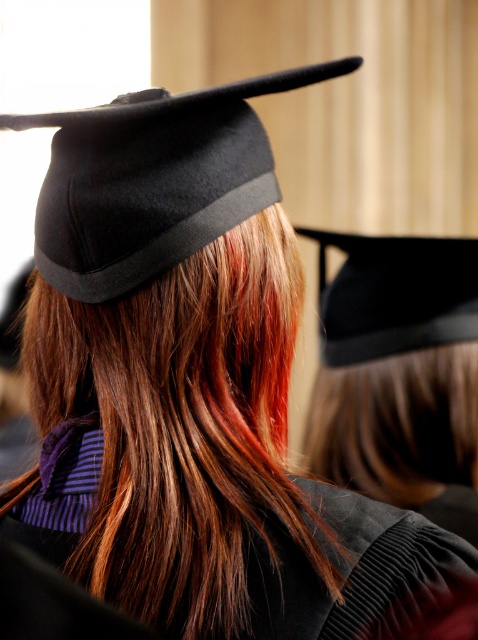
Is point (164, 205) less distant than point (387, 346)?

Yes, point (164, 205) is closer to viewer.

Can you confirm if black felt graduation cap at upper center is smaller than black matte graduation cap at center?

Correct, black felt graduation cap at upper center occupies less space than black matte graduation cap at center.

Is point (91, 232) in front of point (380, 314)?

Yes, point (91, 232) is closer to viewer.

At what (x,y) coordinates should I click in order to perform the action: click on black felt graduation cap at upper center. Please return your answer as a coordinate pair (x, y). Looking at the image, I should click on (152, 179).

Between brown silky hair at center and black felt graduation cap at upper center, which one appears on the left side from the viewer's perspective?

Positioned to the left is brown silky hair at center.

Is brown silky hair at center shorter than black felt graduation cap at upper center?

No.

I want to click on brown silky hair at center, so click(178, 424).

Does velvet black robe at center have a smaller size compared to black matte graduation cap at center?

Yes.

Does velvet black robe at center appear on the left side of black matte graduation cap at center?

Indeed, velvet black robe at center is positioned on the left side of black matte graduation cap at center.

Which is in front, point (335, 621) or point (419, 282)?

Point (335, 621) is more forward.

At what (x,y) coordinates should I click in order to perform the action: click on velvet black robe at center. Please return your answer as a coordinate pair (x, y). Image resolution: width=478 pixels, height=640 pixels. Looking at the image, I should click on (347, 566).